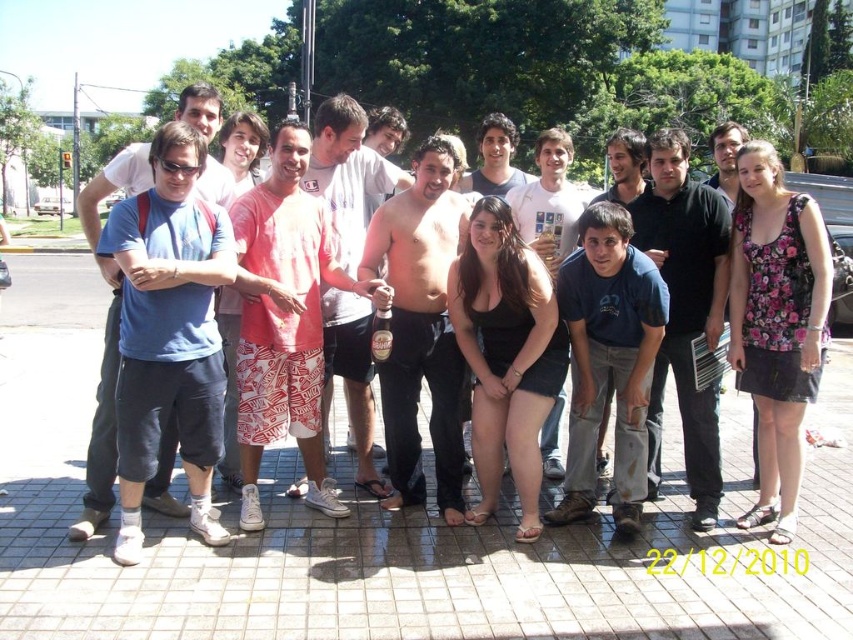
Which is more to the left, matte black shirt at center or translucent plastic bottle at center?

Positioned to the left is translucent plastic bottle at center.

This screenshot has width=853, height=640. What do you see at coordinates (548, 200) in the screenshot?
I see `matte black shirt at center` at bounding box center [548, 200].

Where is `matte black shirt at center`? Image resolution: width=853 pixels, height=640 pixels. matte black shirt at center is located at coordinates (548, 200).

The width and height of the screenshot is (853, 640). Find the location of `smooth gray shirt at center`. smooth gray shirt at center is located at coordinates (494, 157).

Is point (503, 147) positioned after point (376, 310)?

Yes, point (503, 147) is behind point (376, 310).

Where is `smooth gray shirt at center`? The width and height of the screenshot is (853, 640). smooth gray shirt at center is located at coordinates (494, 157).

Is point (340, 154) behind point (552, 259)?

No, it is not.

Who is more forward, (329, 112) or (540, 132)?

Point (329, 112) is in front.

I want to click on shiny metallic can at center, so click(347, 173).